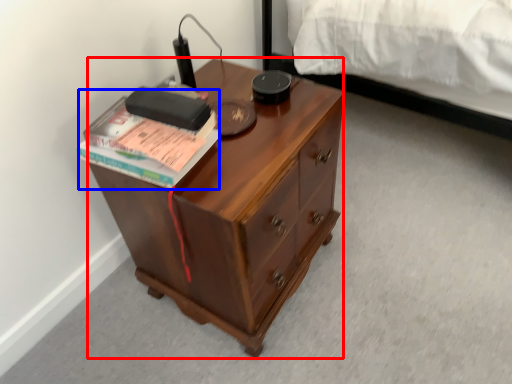
Question: Which of the following is the closest to the observer, desk (highlighted by a red box) or paperback book (highlighted by a blue box)?

Choices:
 (A) desk
 (B) paperback book

Answer: (A)